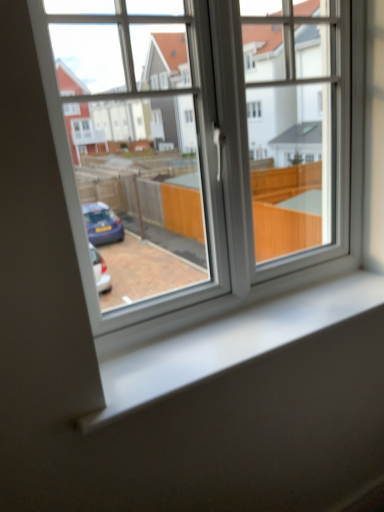
At what (x,y) coordinates should I click in order to perform the action: click on white glossy window sill at center. Please return your answer as a coordinate pair (x, y). This screenshot has height=512, width=384. Looking at the image, I should click on (229, 343).

The height and width of the screenshot is (512, 384). Describe the element at coordinates (229, 343) in the screenshot. I see `white glossy window sill at center` at that location.

Image resolution: width=384 pixels, height=512 pixels. What are the coordinates of `white plastic window at center` in the screenshot? It's located at (205, 142).

What do you see at coordinates (205, 142) in the screenshot? I see `white plastic window at center` at bounding box center [205, 142].

Locate an element on the screen. white glossy window sill at center is located at coordinates (229, 343).

Considering the positions of objects white plastic window at center and white glossy window sill at center in the image provided, who is more to the left, white plastic window at center or white glossy window sill at center?

From the viewer's perspective, white plastic window at center appears more on the left side.

Is white plastic window at center positioned behind white glossy window sill at center?

No, white plastic window at center is closer to the viewer.

Between point (177, 45) and point (261, 310), which one is positioned in front?

The point (177, 45) is closer.

From the image's perspective, would you say white plastic window at center is shown under white glossy window sill at center?

No, from the image's perspective, white plastic window at center is not below white glossy window sill at center.

From a real-world perspective, which object stands above the other?

white plastic window at center is physically above.

Does white plastic window at center have a greater width compared to white glossy window sill at center?

No.

Can you confirm if white plastic window at center is shorter than white glossy window sill at center?

No, white plastic window at center is not shorter than white glossy window sill at center.

Which of these two, white plastic window at center or white glossy window sill at center, is bigger?

white plastic window at center.

Does white plastic window at center contain white glossy window sill at center?

No, white glossy window sill at center is not surrounded by white plastic window at center.

Is white plastic window at center far away from white glossy window sill at center?

No, white plastic window at center is not far from white glossy window sill at center.

Is white plastic window at center oriented towards white glossy window sill at center?

Yes, white plastic window at center is facing white glossy window sill at center.

Based on the photo, what's the angular difference between white plastic window at center and white glossy window sill at center's facing directions?

There is a 0.00229-degree angle between the facing directions of white plastic window at center and white glossy window sill at center.

How far apart are white plastic window at center and white glossy window sill at center?

A distance of 14.61 inches exists between white plastic window at center and white glossy window sill at center.

You are a GUI agent. You are given a task and a screenshot of the screen. Output one action in this format:
    pyautogui.click(x=<x>, y=<y>)
    Task: Click on the window sill below the white plastic window at center (from the image's perspective)
    The height and width of the screenshot is (512, 384).
    Given the screenshot: What is the action you would take?
    pyautogui.click(x=229, y=343)

Can you confirm if white glossy window sill at center is positioned to the right of white plastic window at center?

Indeed, white glossy window sill at center is positioned on the right side of white plastic window at center.

Is white glossy window sill at center positioned in front of white plastic window at center?

No, it is not.

Between point (228, 348) and point (275, 98), which one is positioned in front?

The point (228, 348) is in front.

From the image's perspective, is white glossy window sill at center below white plastic window at center?

Yes, from the image's perspective, white glossy window sill at center is beneath white plastic window at center.

From a real-world perspective, is white glossy window sill at center positioned above or below white plastic window at center?

Clearly, from a real-world perspective, white glossy window sill at center is below white plastic window at center.

Is white glossy window sill at center thinner than white plastic window at center?

No, white glossy window sill at center is not thinner than white plastic window at center.

Is white glossy window sill at center taller or shorter than white plastic window at center?

Considering their sizes, white glossy window sill at center has less height than white plastic window at center.

Between white glossy window sill at center and white plastic window at center, which one has smaller size?

white glossy window sill at center is smaller.

Can we say white glossy window sill at center lies outside white plastic window at center?

Yes, white glossy window sill at center is located beyond the bounds of white plastic window at center.

Is white glossy window sill at center not near white plastic window at center?

No, there isn't a large distance between white glossy window sill at center and white plastic window at center.

Is white glossy window sill at center facing towards white plastic window at center?

No, white glossy window sill at center is not turned towards white plastic window at center.

What are the coordinates of `window in front of the white glossy window sill at center` in the screenshot? It's located at (205, 142).

This screenshot has height=512, width=384. In order to click on window that appears above the white glossy window sill at center (from the image's perspective) in this screenshot , I will do `click(205, 142)`.

This screenshot has height=512, width=384. In order to click on window located above the white glossy window sill at center (from a real-world perspective) in this screenshot , I will do `click(205, 142)`.